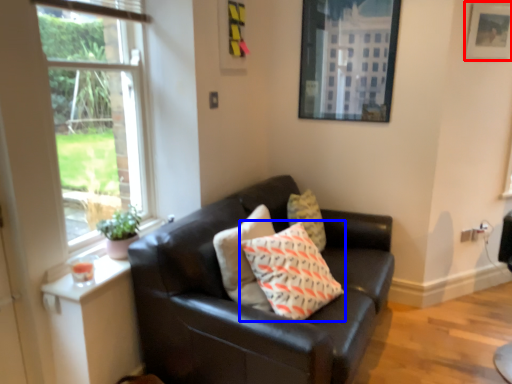
Question: Among these objects, which one is farthest to the camera, picture frame (highlighted by a red box) or pillow (highlighted by a blue box)?

Choices:
 (A) picture frame
 (B) pillow

Answer: (A)